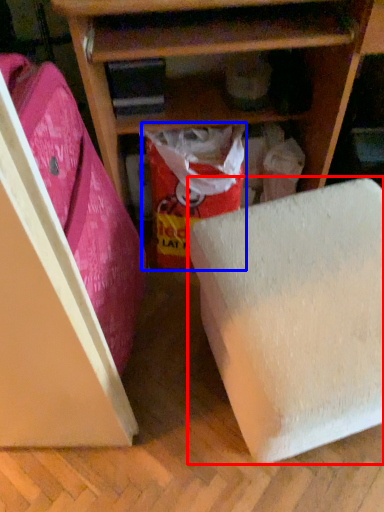
Question: Among these objects, which one is nearest to the camera, furniture (highlighted by a red box) or wrapping paper (highlighted by a blue box)?

Choices:
 (A) furniture
 (B) wrapping paper

Answer: (A)